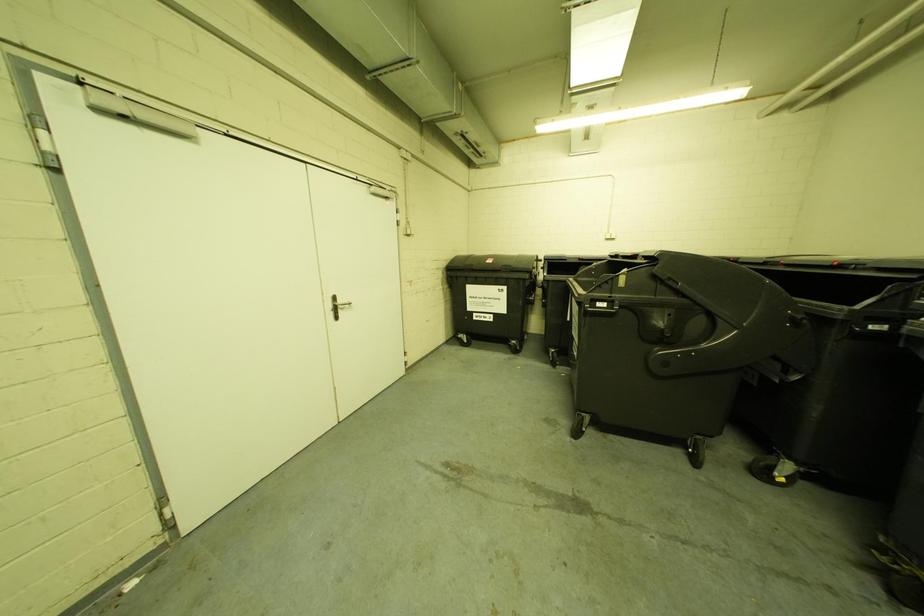
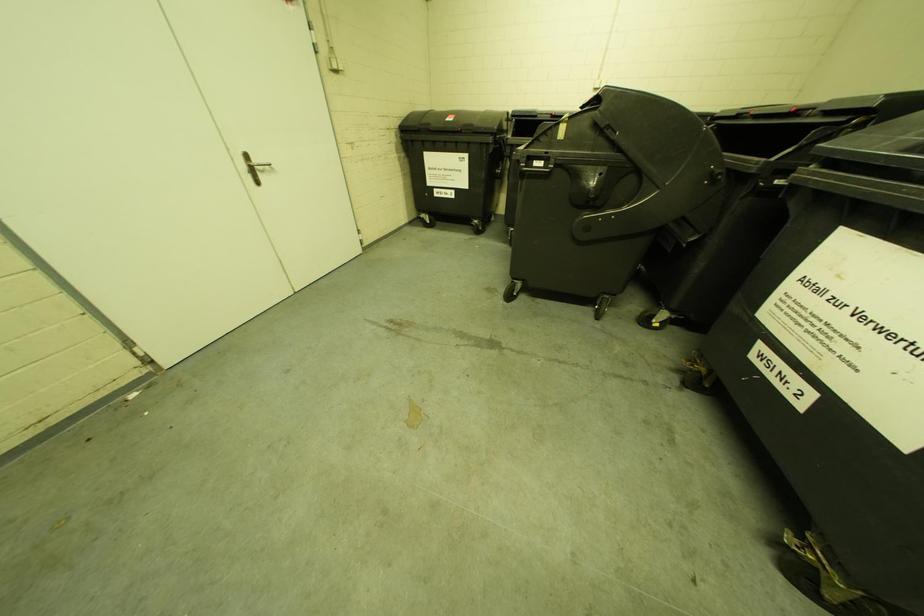
Question: The images are taken continuously from a first-person perspective. In which direction is your viewpoint rotating?

Choices:
 (A) Left
 (B) Right
 (C) Up
 (D) Down

Answer: (D)